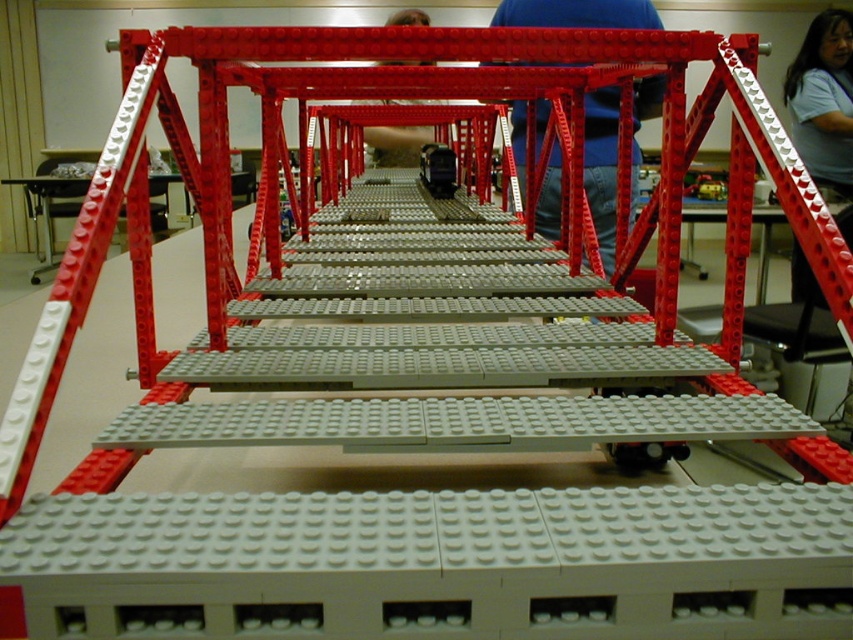
From the picture: Can you confirm if blue fabric shirt at center is positioned above matte gray shirt at upper right?

Incorrect, blue fabric shirt at center is not positioned above matte gray shirt at upper right.

Identify the location of blue fabric shirt at center. This screenshot has height=640, width=853. (601, 166).

Is blue fabric shirt at center wider than matte plastic person at center?

In fact, blue fabric shirt at center might be narrower than matte plastic person at center.

Is blue fabric shirt at center in front of matte plastic person at center?

Yes, it is.

Which is behind, point (558, 186) or point (383, 61)?

The point (383, 61) is more distant.

The image size is (853, 640). Identify the location of blue fabric shirt at center. (601, 166).

Who is lower down, matte gray shirt at upper right or matte plastic person at center?

matte gray shirt at upper right is lower down.

Is matte gray shirt at upper right smaller than matte plastic person at center?

Indeed, matte gray shirt at upper right has a smaller size compared to matte plastic person at center.

This screenshot has width=853, height=640. I want to click on matte gray shirt at upper right, so click(x=822, y=100).